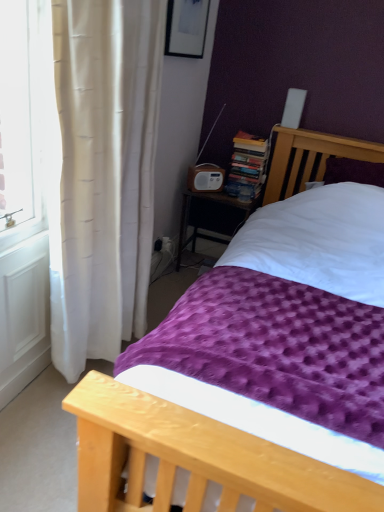
Question: Does hardcover books at center lie behind wooden radio at center?

Choices:
 (A) no
 (B) yes

Answer: (B)

Question: Does hardcover books at center turn towards wooden radio at center?

Choices:
 (A) no
 (B) yes

Answer: (A)

Question: Can we say hardcover books at center lies outside wooden radio at center?

Choices:
 (A) yes
 (B) no

Answer: (A)

Question: Is hardcover books at center turned away from wooden radio at center?

Choices:
 (A) no
 (B) yes

Answer: (A)

Question: From a real-world perspective, is hardcover books at center located higher than wooden radio at center?

Choices:
 (A) yes
 (B) no

Answer: (A)

Question: From a real-world perspective, is white plastic radio at center positioned above or below wooden radio at center?

Choices:
 (A) above
 (B) below

Answer: (A)

Question: In terms of size, does white plastic radio at center appear bigger or smaller than wooden radio at center?

Choices:
 (A) big
 (B) small

Answer: (B)

Question: Is white plastic radio at center spatially inside wooden radio at center, or outside of it?

Choices:
 (A) outside
 (B) inside

Answer: (A)

Question: From the image's perspective, is white plastic radio at center above or below wooden radio at center?

Choices:
 (A) above
 (B) below

Answer: (A)

Question: Visually, is purple textured blanket at center positioned to the left or to the right of wooden radio at center?

Choices:
 (A) left
 (B) right

Answer: (B)

Question: From the image's perspective, is purple textured blanket at center located above or below wooden radio at center?

Choices:
 (A) below
 (B) above

Answer: (A)

Question: In the image, is purple textured blanket at center positioned in front of or behind wooden radio at center?

Choices:
 (A) behind
 (B) front

Answer: (B)

Question: Looking at their shapes, would you say purple textured blanket at center is wider or thinner than wooden radio at center?

Choices:
 (A) wide
 (B) thin

Answer: (A)

Question: From the image's perspective, is purple textured blanket at center located above or below hardcover books at center?

Choices:
 (A) above
 (B) below

Answer: (B)

Question: Would you say purple textured blanket at center is to the left or to the right of hardcover books at center in the picture?

Choices:
 (A) right
 (B) left

Answer: (A)